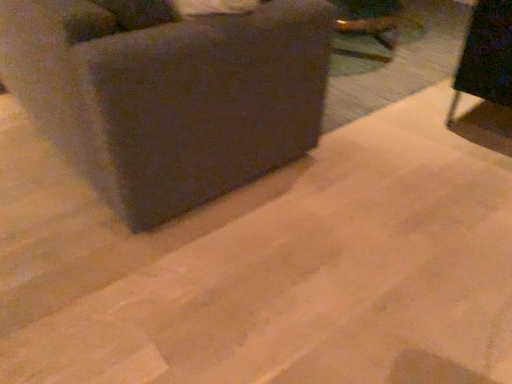
Question: Considering the relative sizes of black fabric chair at upper right, the first furniture from the right, and dark fabric couch at upper left, placed as the 2th furniture when sorted from right to left, in the image provided, is black fabric chair at upper right, the first furniture from the right, bigger than dark fabric couch at upper left, placed as the 2th furniture when sorted from right to left,?

Choices:
 (A) yes
 (B) no

Answer: (B)

Question: From a real-world perspective, does black fabric chair at upper right, the first furniture from the right, stand above dark fabric couch at upper left, the 1th furniture from the left?

Choices:
 (A) no
 (B) yes

Answer: (A)

Question: Is black fabric chair at upper right, the first furniture from the right, facing away from dark fabric couch at upper left, placed as the 2th furniture when sorted from right to left?

Choices:
 (A) yes
 (B) no

Answer: (B)

Question: Is dark fabric couch at upper left, placed as the 2th furniture when sorted from right to left, completely or partially inside black fabric chair at upper right, the first furniture from the right?

Choices:
 (A) yes
 (B) no

Answer: (B)

Question: Is black fabric chair at upper right, the first furniture from the right, to the left of dark fabric couch at upper left, placed as the 2th furniture when sorted from right to left, from the viewer's perspective?

Choices:
 (A) no
 (B) yes

Answer: (A)

Question: Can you confirm if black fabric chair at upper right, positioned as the 2th furniture in left-to-right order, is positioned to the right of dark fabric couch at upper left, placed as the 2th furniture when sorted from right to left?

Choices:
 (A) yes
 (B) no

Answer: (A)

Question: Does dark fabric couch at upper left, placed as the 2th furniture when sorted from right to left, contain black fabric chair at upper right, positioned as the 2th furniture in left-to-right order?

Choices:
 (A) no
 (B) yes

Answer: (A)

Question: Is dark fabric couch at upper left, the 1th furniture from the left, oriented away from black fabric chair at upper right, positioned as the 2th furniture in left-to-right order?

Choices:
 (A) yes
 (B) no

Answer: (B)

Question: Considering the relative sizes of dark fabric couch at upper left, placed as the 2th furniture when sorted from right to left, and black fabric chair at upper right, the first furniture from the right, in the image provided, is dark fabric couch at upper left, placed as the 2th furniture when sorted from right to left, smaller than black fabric chair at upper right, the first furniture from the right,?

Choices:
 (A) no
 (B) yes

Answer: (A)

Question: Can you confirm if dark fabric couch at upper left, placed as the 2th furniture when sorted from right to left, is thinner than black fabric chair at upper right, positioned as the 2th furniture in left-to-right order?

Choices:
 (A) no
 (B) yes

Answer: (A)

Question: Is dark fabric couch at upper left, placed as the 2th furniture when sorted from right to left, at the right side of black fabric chair at upper right, the first furniture from the right?

Choices:
 (A) yes
 (B) no

Answer: (B)

Question: Is dark fabric couch at upper left, placed as the 2th furniture when sorted from right to left, shorter than black fabric chair at upper right, positioned as the 2th furniture in left-to-right order?

Choices:
 (A) yes
 (B) no

Answer: (B)

Question: In the image, is black fabric chair at upper right, the first furniture from the right, positioned in front of or behind dark fabric couch at upper left, the 1th furniture from the left?

Choices:
 (A) behind
 (B) front

Answer: (A)